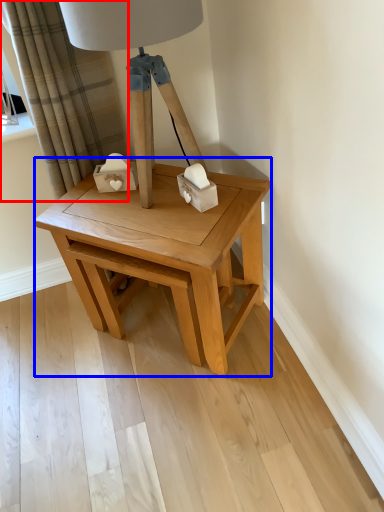
Question: Among these objects, which one is farthest to the camera, curtain (highlighted by a red box) or table (highlighted by a blue box)?

Choices:
 (A) curtain
 (B) table

Answer: (A)